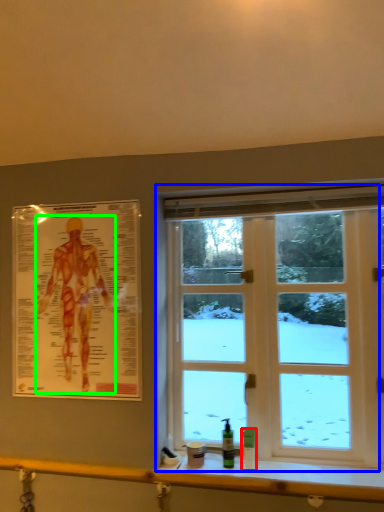
Question: Based on their relative distances, which object is nearer to toiletry (highlighted by a red box)? Choose from window (highlighted by a blue box) and person (highlighted by a green box).

Choices:
 (A) window
 (B) person

Answer: (A)